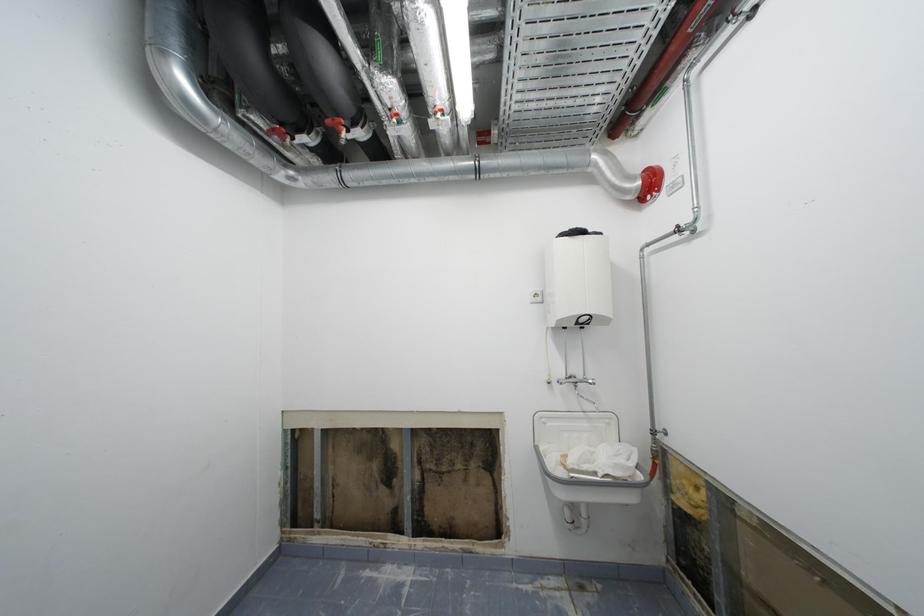
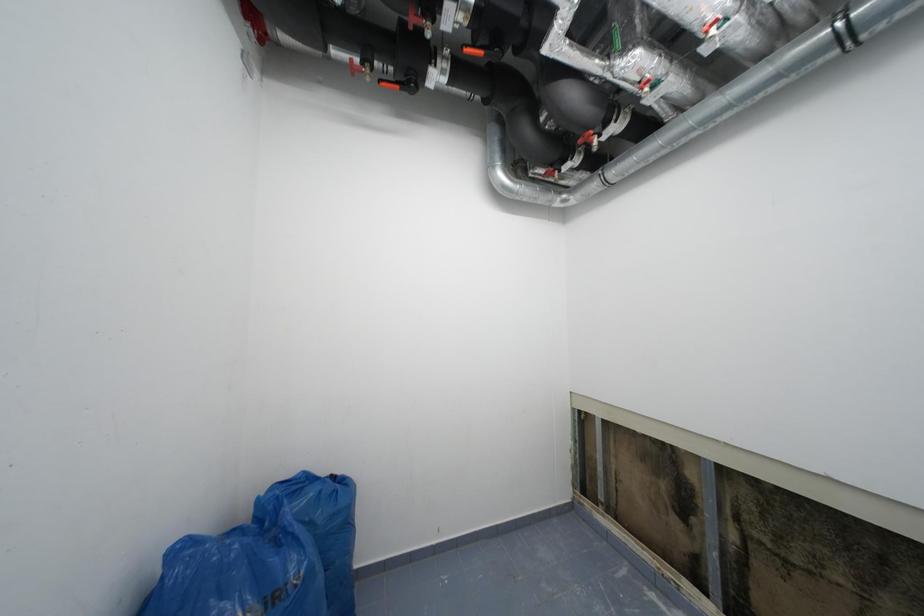
Question: The first image is from the beginning of the video and the second image is from the end. How did the camera likely rotate when shooting the video?

Choices:
 (A) Left
 (B) Right
 (C) Up
 (D) Down

Answer: (A)